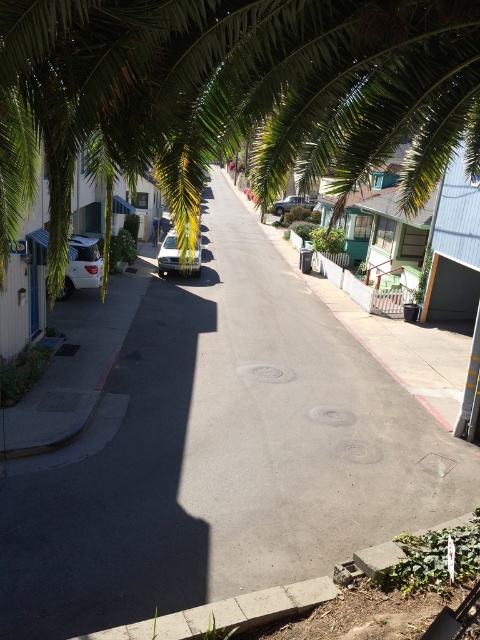
What do you see at coordinates (82, 266) in the screenshot? I see `silver metallic car at left` at bounding box center [82, 266].

Can you confirm if silver metallic car at left is bigger than silver metallic sedan at center?

Incorrect, silver metallic car at left is not larger than silver metallic sedan at center.

Which is in front, point (84, 253) or point (301, 205)?

Positioned in front is point (84, 253).

Locate an element on the screen. silver metallic car at left is located at coordinates (82, 266).

Can you confirm if silver metallic car at left is shorter than silver metallic car at center?

Correct, silver metallic car at left is not as tall as silver metallic car at center.

What do you see at coordinates (82, 266) in the screenshot? I see `silver metallic car at left` at bounding box center [82, 266].

This screenshot has width=480, height=640. I want to click on silver metallic car at left, so click(x=82, y=266).

Can you confirm if gray asphalt pavement at center is bigger than silver metallic car at center?

Correct, gray asphalt pavement at center is larger in size than silver metallic car at center.

Which is more to the left, gray asphalt pavement at center or silver metallic car at center?

From the viewer's perspective, silver metallic car at center appears more on the left side.

I want to click on gray asphalt pavement at center, so click(223, 452).

Locate an element on the screen. The image size is (480, 640). gray asphalt pavement at center is located at coordinates (223, 452).